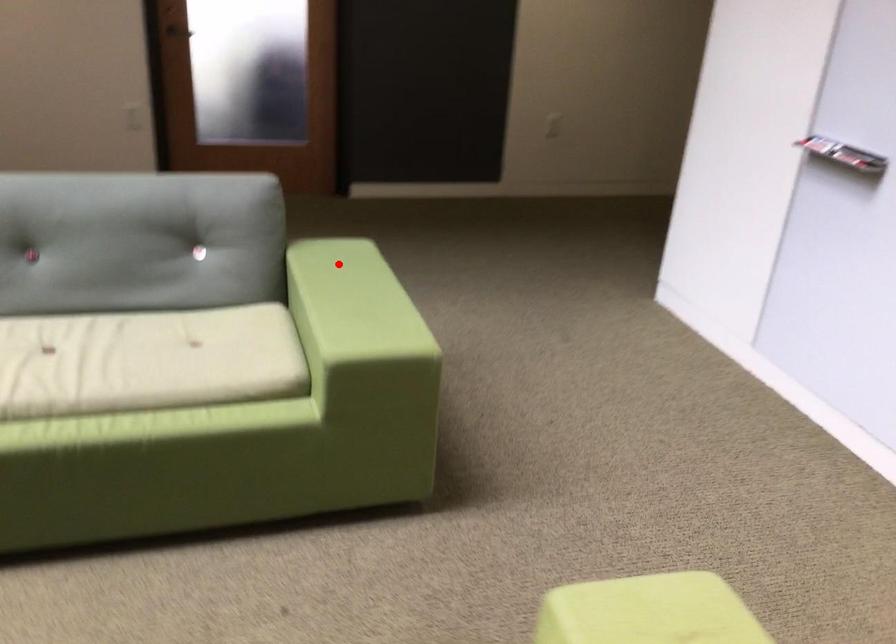
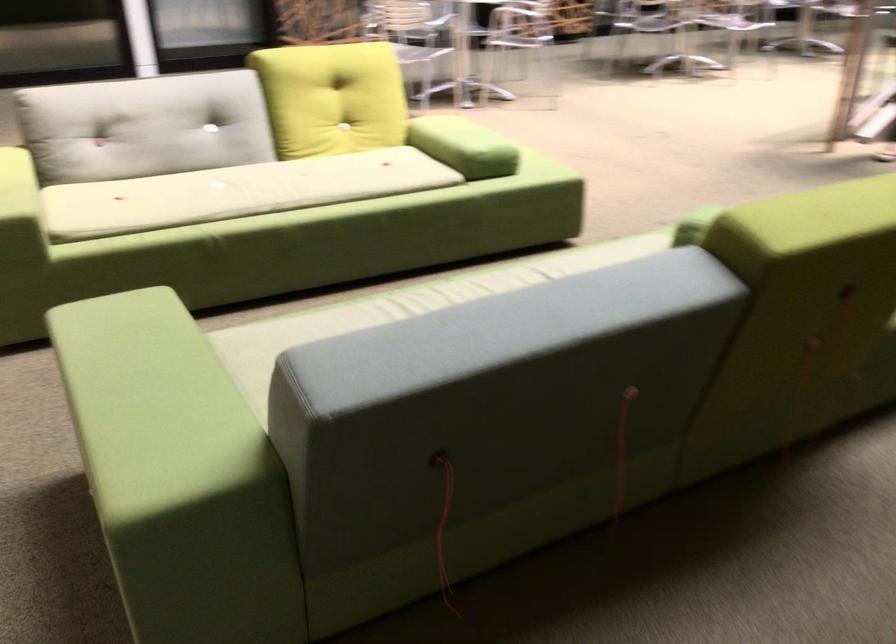
Question: A red point is marked in image1. In image2, is the corresponding 3D point closer to the camera or farther? Reply with the corresponding letter.

Choices:
 (A) The corresponding 3D point is closer.
 (B) The corresponding 3D point is farther.

Answer: (A)